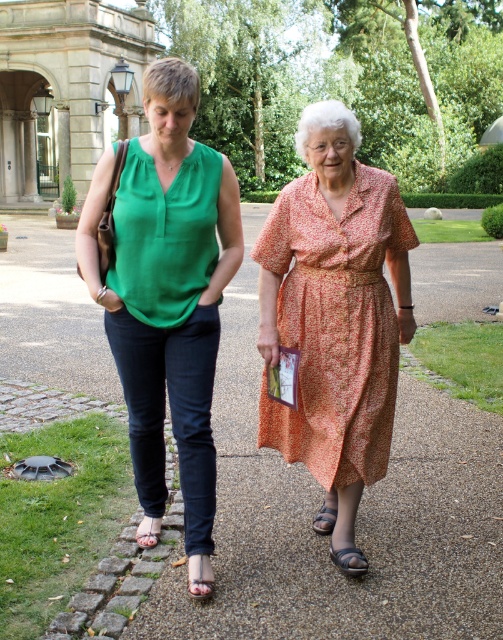
Between brown gravel pavement at center and printed cotton dress at center, which one appears on the left side from the viewer's perspective?

brown gravel pavement at center

Is point (286, 516) closer to camera compared to point (288, 273)?

No, it is not.

This screenshot has width=503, height=640. Identify the location of brown gravel pavement at center. (357, 520).

Does brown gravel pavement at center appear under matte orange dress at center?

Incorrect, brown gravel pavement at center is not positioned below matte orange dress at center.

Can you confirm if brown gravel pavement at center is positioned above matte orange dress at center?

Yes, brown gravel pavement at center is above matte orange dress at center.

Which is behind, point (477, 412) or point (163, 140)?

Point (477, 412)

The width and height of the screenshot is (503, 640). Identify the location of brown gravel pavement at center. (357, 520).

Is matte orange dress at center above printed cotton dress at center?

Yes, matte orange dress at center is above printed cotton dress at center.

Is matte orange dress at center to the right of printed cotton dress at center from the viewer's perspective?

Incorrect, matte orange dress at center is not on the right side of printed cotton dress at center.

You are a GUI agent. You are given a task and a screenshot of the screen. Output one action in this format:
    pyautogui.click(x=<x>, y=<y>)
    Task: Click on the matte orange dress at center
    
    Given the screenshot: What is the action you would take?
    pyautogui.click(x=166, y=289)